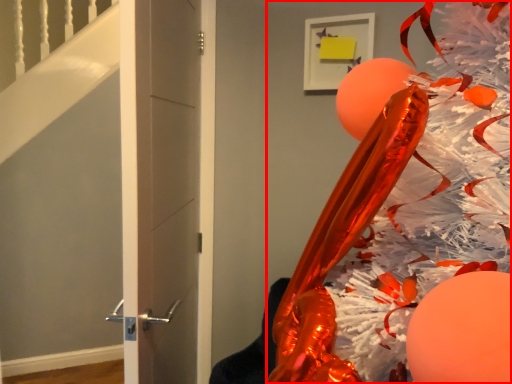
Question: From the image's perspective, where is christmas tree (annotated by the red box) located relative to door?

Choices:
 (A) above
 (B) below

Answer: (B)